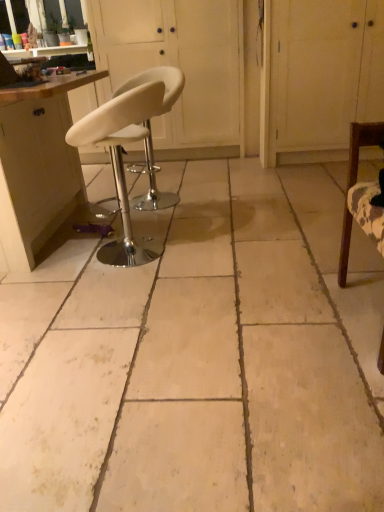
Where is `vacant point to the left of wooden chair at right, which ranks as the third chair in back-to-front order`? This screenshot has height=512, width=384. vacant point to the left of wooden chair at right, which ranks as the third chair in back-to-front order is located at coordinates pyautogui.click(x=279, y=333).